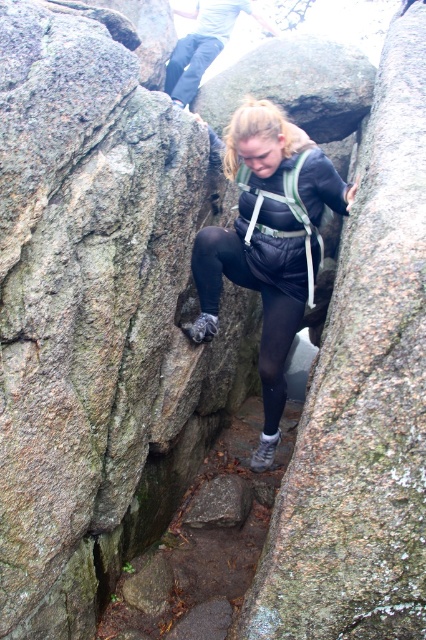
You are a climber trying to navigate through the narrow passage between the two large boulders. You have two footholds marked at point coordinates point (322, 180) and point (275, 372). Which foothold should you use first to move forward effectively?

You should use the foothold at point (322, 180) first because it is positioned in front of point (275, 372), allowing you to progress forward through the narrow passage.

You are a rock climber attempting to navigate through the narrow passage between the two boulders. You notice both the black matte jumpsuit at center and the black matte leggings at center. Which piece of clothing is closer to you as you climb?

The black matte jumpsuit at center is closer to you because it is in front of the black matte leggings at center.